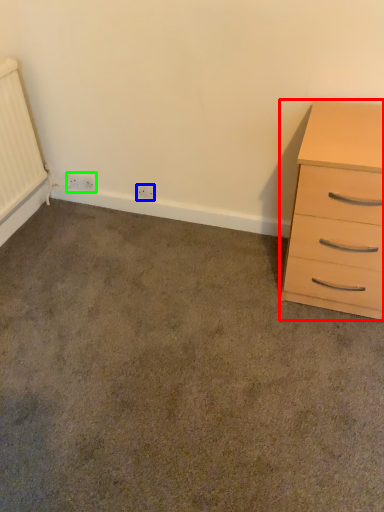
Question: Estimate the real-world distances between objects in this image. Which object is closer to chest of drawers (highlighted by a red box), electric outlet (highlighted by a blue box) or electric outlet (highlighted by a green box)?

Choices:
 (A) electric outlet
 (B) electric outlet

Answer: (A)